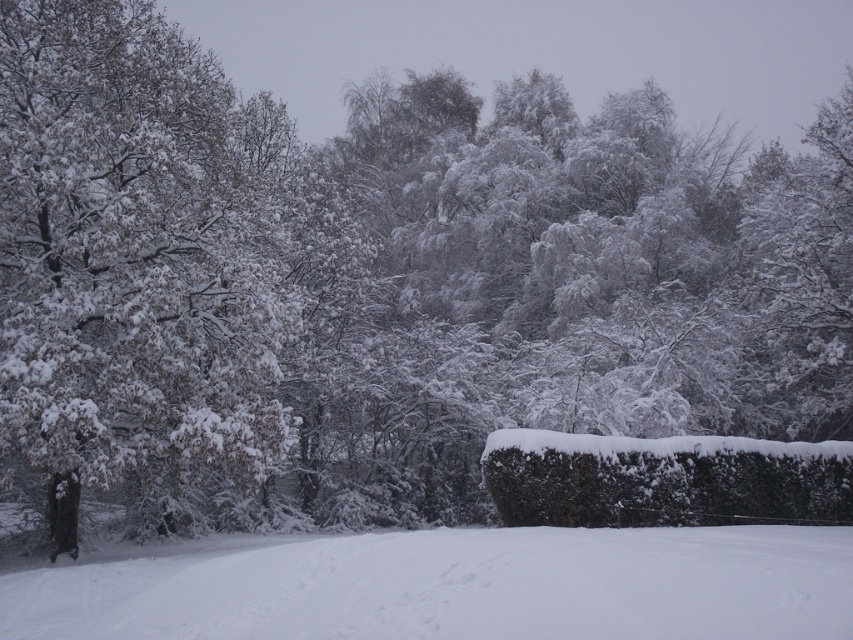
You are an observer standing in the winter scene. You notice the white frosty tree at upper right and the green textured hedge at lower right. Which object is taller?

The white frosty tree at upper right is much taller than the green textured hedge at lower right.

You are an artist trying to paint the winter scene. You need to decide which object to paint first based on their widths. Which one should you start with, the white frosty tree at upper right or the green textured hedge at lower right?

You should start with the white frosty tree at upper right because its width surpasses that of the green textured hedge at lower right, making it a larger feature to paint first.